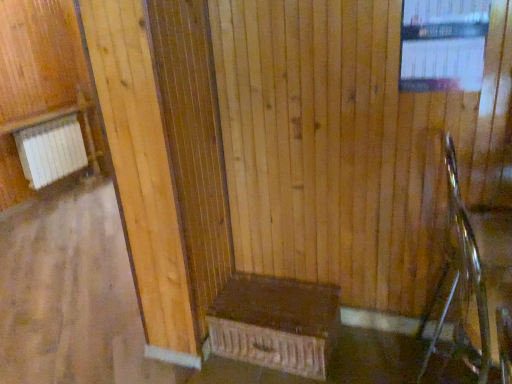
Find the location of `metallic silver rocking chair at right`. metallic silver rocking chair at right is located at coordinates (469, 273).

At what (x,y) coordinates should I click in order to perform the action: click on transparent glass window at upper right. Please return your answer as a coordinate pair (x, y). The width and height of the screenshot is (512, 384). Looking at the image, I should click on (443, 45).

Can you confirm if transparent glass window at upper right is wider than dark brown wood bench at center?

No.

Is transparent glass window at upper right closer to camera compared to dark brown wood bench at center?

Yes, it is in front of dark brown wood bench at center.

Is transparent glass window at upper right aimed at dark brown wood bench at center?

No.

Does transparent glass window at upper right contain dark brown wood bench at center?

No.

From the image's perspective, between dark brown wood bench at center and transparent glass window at upper right, which one is located above?

transparent glass window at upper right, from the image's perspective.

Which object is positioned more to the right, dark brown wood bench at center or transparent glass window at upper right?

From the viewer's perspective, transparent glass window at upper right appears more on the right side.

Is point (335, 318) positioned behind point (480, 48)?

Yes, it is.

From their relative heights in the image, would you say dark brown wood bench at center is taller or shorter than transparent glass window at upper right?

Considering their sizes, dark brown wood bench at center has less height than transparent glass window at upper right.

Which of these two, metallic silver rocking chair at right or transparent glass window at upper right, is thinner?

With smaller width is transparent glass window at upper right.

Is there a large distance between metallic silver rocking chair at right and transparent glass window at upper right?

They are positioned close to each other.

Considering the sizes of objects metallic silver rocking chair at right and transparent glass window at upper right in the image provided, who is bigger, metallic silver rocking chair at right or transparent glass window at upper right?

metallic silver rocking chair at right is bigger.

From a real-world perspective, is metallic silver rocking chair at right on transparent glass window at upper right?

Actually, metallic silver rocking chair at right is physically below transparent glass window at upper right in the real world.

Considering the sizes of objects metallic silver rocking chair at right and dark brown wood bench at center in the image provided, who is taller, metallic silver rocking chair at right or dark brown wood bench at center?

metallic silver rocking chair at right.

Where is `furniture on the left of the metallic silver rocking chair at right`? furniture on the left of the metallic silver rocking chair at right is located at coordinates (275, 323).

Can you confirm if metallic silver rocking chair at right is positioned to the left of dark brown wood bench at center?

Incorrect, metallic silver rocking chair at right is not on the left side of dark brown wood bench at center.

Considering their positions, is metallic silver rocking chair at right located in front of or behind dark brown wood bench at center?

Clearly, metallic silver rocking chair at right is in front of dark brown wood bench at center.

From a real-world perspective, between dark brown wood bench at center and metallic silver rocking chair at right, who is vertically lower?

In real-world perspective, dark brown wood bench at center is lower.

Are dark brown wood bench at center and metallic silver rocking chair at right beside each other?

No, dark brown wood bench at center is not with metallic silver rocking chair at right.

Which is less distant, (323, 371) or (446, 240)?

The point (323, 371) is in front.

Considering the sizes of dark brown wood bench at center and metallic silver rocking chair at right in the image, is dark brown wood bench at center taller or shorter than metallic silver rocking chair at right?

Clearly, dark brown wood bench at center is shorter compared to metallic silver rocking chair at right.

Does transparent glass window at upper right touch metallic silver rocking chair at right?

transparent glass window at upper right and metallic silver rocking chair at right are clearly separated.

From a real-world perspective, is transparent glass window at upper right above or below metallic silver rocking chair at right?

In terms of real-world spatial position, transparent glass window at upper right is above metallic silver rocking chair at right.

The image size is (512, 384). In order to click on window that appears on the left of metallic silver rocking chair at right in this screenshot , I will do `click(443, 45)`.

Locate an element on the screen. Image resolution: width=512 pixels, height=384 pixels. window that appears above the dark brown wood bench at center (from a real-world perspective) is located at coordinates (443, 45).

Image resolution: width=512 pixels, height=384 pixels. I want to click on window above the dark brown wood bench at center (from the image's perspective), so click(443, 45).

Estimate the real-world distances between objects in this image. Which object is closer to metallic silver rocking chair at right, dark brown wood bench at center or transparent glass window at upper right?

transparent glass window at upper right lies closer to metallic silver rocking chair at right than the other object.

Consider the image. Based on their spatial positions, is transparent glass window at upper right or dark brown wood bench at center further from metallic silver rocking chair at right?

dark brown wood bench at center is further to metallic silver rocking chair at right.

Based on the photo, from the image, which object appears to be farther from transparent glass window at upper right, dark brown wood bench at center or metallic silver rocking chair at right?

dark brown wood bench at center is further to transparent glass window at upper right.

Which object lies further to the anchor point transparent glass window at upper right, metallic silver rocking chair at right or dark brown wood bench at center?

dark brown wood bench at center.

Looking at the image, which one is located closer to dark brown wood bench at center, transparent glass window at upper right or metallic silver rocking chair at right?

metallic silver rocking chair at right is closer to dark brown wood bench at center.

Looking at the image, which one is located further to dark brown wood bench at center, metallic silver rocking chair at right or transparent glass window at upper right?

Among the two, transparent glass window at upper right is located further to dark brown wood bench at center.

Locate an element on the screen. rocking chair between transparent glass window at upper right and dark brown wood bench at center vertically is located at coordinates (469, 273).